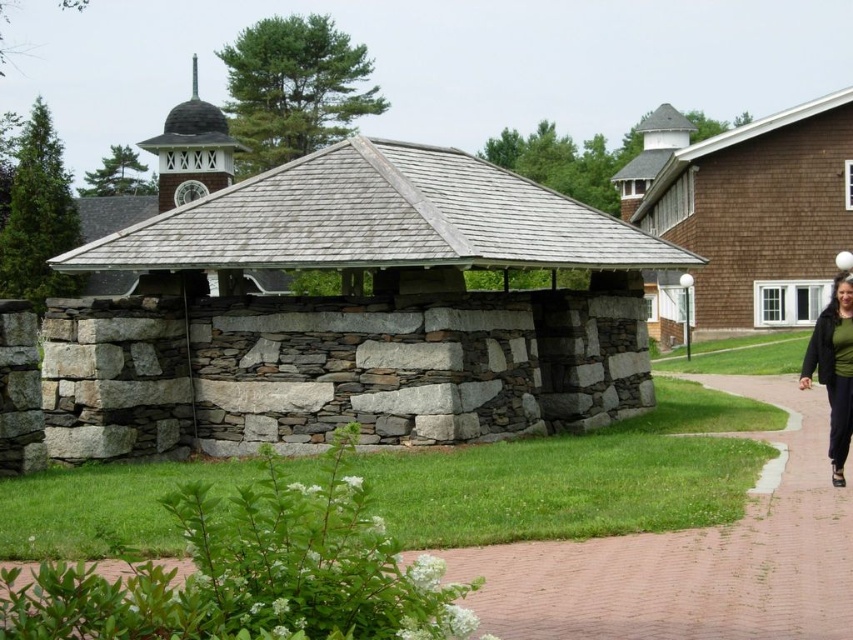
In the scene shown: Can you confirm if gray stone gazebo at center is shorter than green matte jacket at lower right?

In fact, gray stone gazebo at center may be taller than green matte jacket at lower right.

Between point (293, 296) and point (833, 372), which one is positioned behind?

Point (293, 296)

Is point (216, 452) farther from viewer compared to point (828, 324)?

Yes, point (216, 452) is behind point (828, 324).

You are a GUI agent. You are given a task and a screenshot of the screen. Output one action in this format:
    pyautogui.click(x=<x>, y=<y>)
    Task: Click on the gray stone gazebo at center
    
    Given the screenshot: What is the action you would take?
    pyautogui.click(x=347, y=308)

From the picture: Measure the distance from gray stone gazebo at center to brick pavement at lower center.

gray stone gazebo at center and brick pavement at lower center are 22.54 meters apart.

Can you confirm if gray stone gazebo at center is thinner than brick pavement at lower center?

Incorrect, gray stone gazebo at center's width is not less than brick pavement at lower center's.

Is point (68, 252) farther from camera compared to point (492, 627)?

That is True.

Identify the location of gray stone gazebo at center. (347, 308).

Does brick pavement at lower center have a greater height compared to green matte jacket at lower right?

No, brick pavement at lower center is not taller than green matte jacket at lower right.

Is brick pavement at lower center thinner than green matte jacket at lower right?

Yes.

This screenshot has width=853, height=640. I want to click on brick pavement at lower center, so click(691, 557).